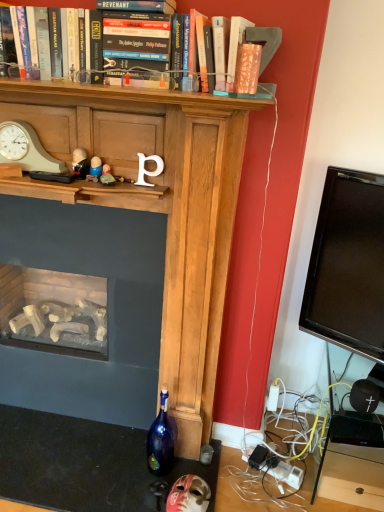
Question: Considering the positions of matte pink paper at upper center and matte beige clock at left in the image, is matte pink paper at upper center wider or thinner than matte beige clock at left?

Choices:
 (A) wide
 (B) thin

Answer: (A)

Question: Considering the positions of point (241, 64) and point (34, 139), is point (241, 64) closer or farther from the camera than point (34, 139)?

Choices:
 (A) farther
 (B) closer

Answer: (B)

Question: Considering the real-world distances, which object is closest to the black plastic drawer at lower right?

Choices:
 (A) black matte speaker at lower right
 (B) matte beige clock at left
 (C) blue glass bottle at lower center
 (D) matte stone figurine at center, the 3th toy positioned from the left
 (E) matte black figurine at center, the 1th toy from the left

Answer: (A)

Question: Estimate the real-world distances between objects in this image. Which object is farther from the blue glass bottle at lower center?

Choices:
 (A) matte beige clock at left
 (B) matte black figurine at center, positioned as the fourth toy in right-to-left order
 (C) matte pink paper at upper center
 (D) matte pink mask at lower center, the first toy in the bottom-to-top sequence
 (E) black matte speaker at lower right

Answer: (C)